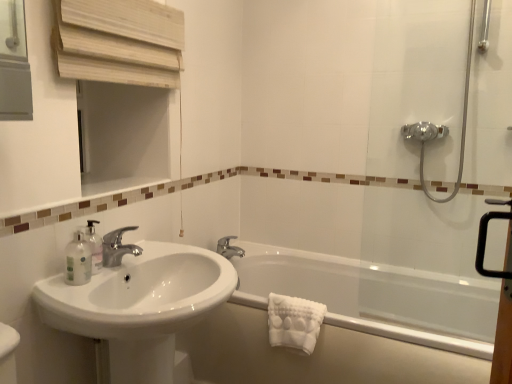
Question: From a real-world perspective, is polished chrome faucet at center, acting as the first tap starting from the front, positioned above or below wooden medicine cabinet at upper left?

Choices:
 (A) above
 (B) below

Answer: (B)

Question: Based on their sizes in the image, would you say polished chrome faucet at center, acting as the first tap starting from the front, is bigger or smaller than wooden medicine cabinet at upper left?

Choices:
 (A) small
 (B) big

Answer: (A)

Question: Which object is the closest to the transparent plastic soap dispenser at left?

Choices:
 (A) silver metallic faucet at upper center, which is counted as the 2th tap, starting from the front
 (B) polished chrome faucet at center, the first tap positioned from the left
 (C) white textured towel at lower right
 (D) white glossy bathtub at lower right
 (E) white glossy sink at lower left

Answer: (B)

Question: Based on their relative distances, which object is farther from the white glossy sink at lower left?

Choices:
 (A) white glossy bathtub at lower right
 (B) polished chrome faucet at center, acting as the 2th tap starting from the back
 (C) white textured towel at lower right
 (D) wooden medicine cabinet at upper left
 (E) transparent glass shower door at right

Answer: (E)